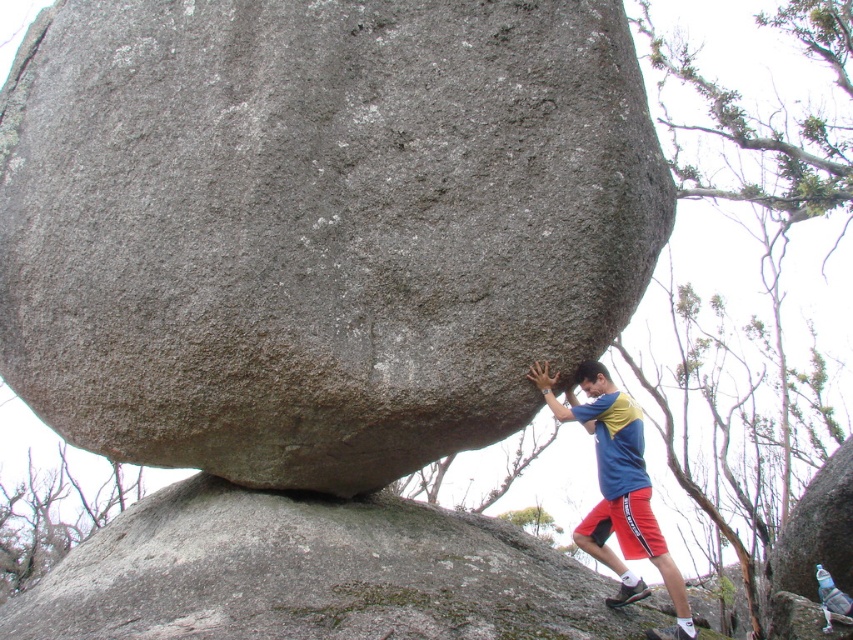
Can you confirm if gray rough rock at center is taller than blue/yellow t-shirt at center?

Correct, gray rough rock at center is much taller as blue/yellow t-shirt at center.

Who is more distant from viewer, [469,435] or [611,513]?

Point [611,513]

Which is behind, point (474, 164) or point (636, 540)?

The point (636, 540) is more distant.

Image resolution: width=853 pixels, height=640 pixels. What are the coordinates of `gray rough rock at center` in the screenshot? It's located at (317, 225).